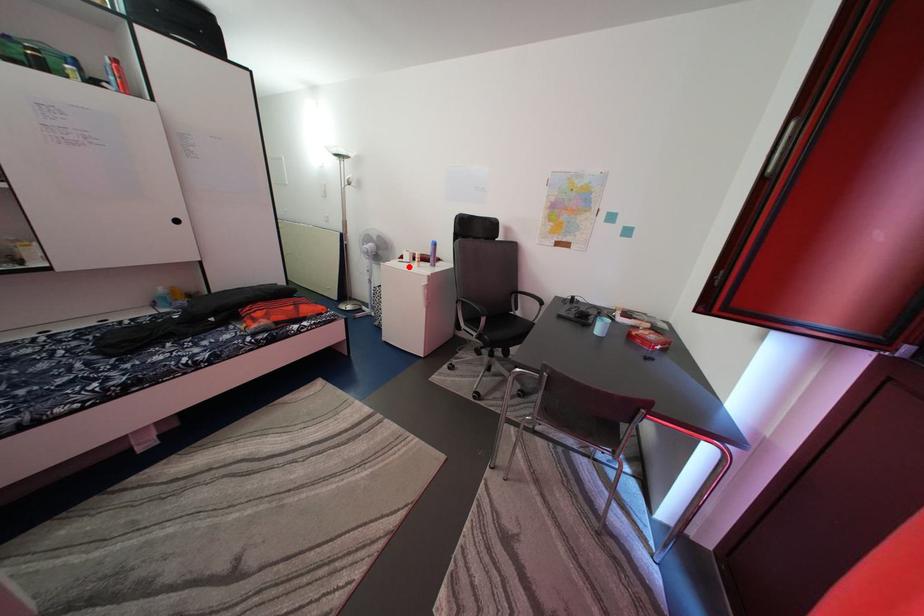
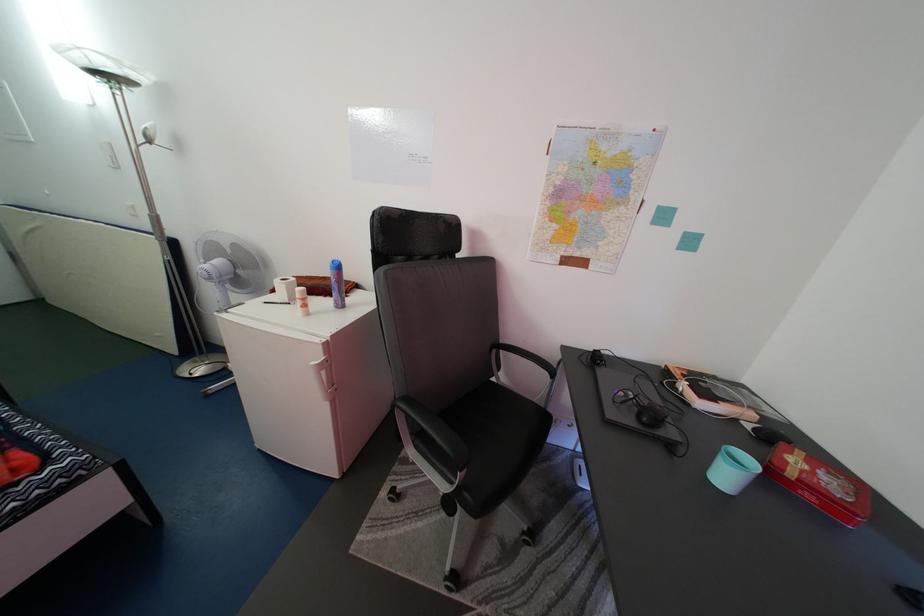
Question: I am providing you with two images of the same scene from different viewpoints. A red point is shown in image1. For the corresponding object point in image2, is it positioned nearer or farther from the camera?

Choices:
 (A) Nearer
 (B) Farther

Answer: (B)